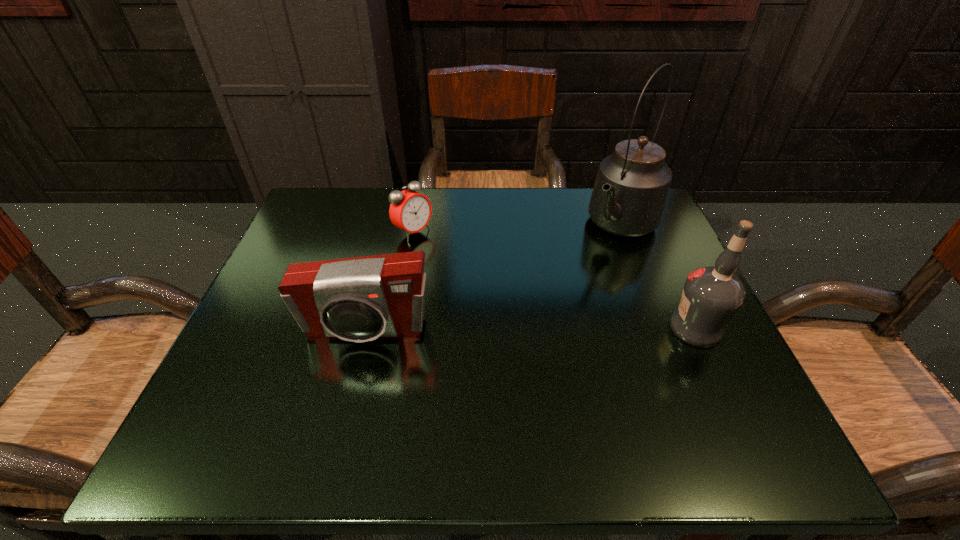
Identify the location of free region located on the front-facing side of the shortest object. (540, 311).

Where is `free space located 0.110m spout on the tallest object`? This screenshot has height=540, width=960. free space located 0.110m spout on the tallest object is located at coordinates (578, 272).

Locate an element on the screen. vacant space located 0.300m spout on the tallest object is located at coordinates point(528,323).

Identify the location of free region located spout on the tallest object. (589, 260).

At what (x,y) coordinates should I click in order to perform the action: click on alarm clock that is at the far edge. Please return your answer as a coordinate pair (x, y). This screenshot has width=960, height=540. Looking at the image, I should click on [410, 211].

I want to click on kettle at the far edge, so click(x=628, y=199).

Find the location of a particular element. object that is positioned at the left edge is located at coordinates (359, 299).

Find the location of a particular element. This screenshot has height=540, width=960. vodka that is at the right edge is located at coordinates (711, 296).

The height and width of the screenshot is (540, 960). Identify the location of kettle at the right edge. (628, 199).

Locate an element on the screen. This screenshot has height=540, width=960. object positioned at the far right corner is located at coordinates (628, 199).